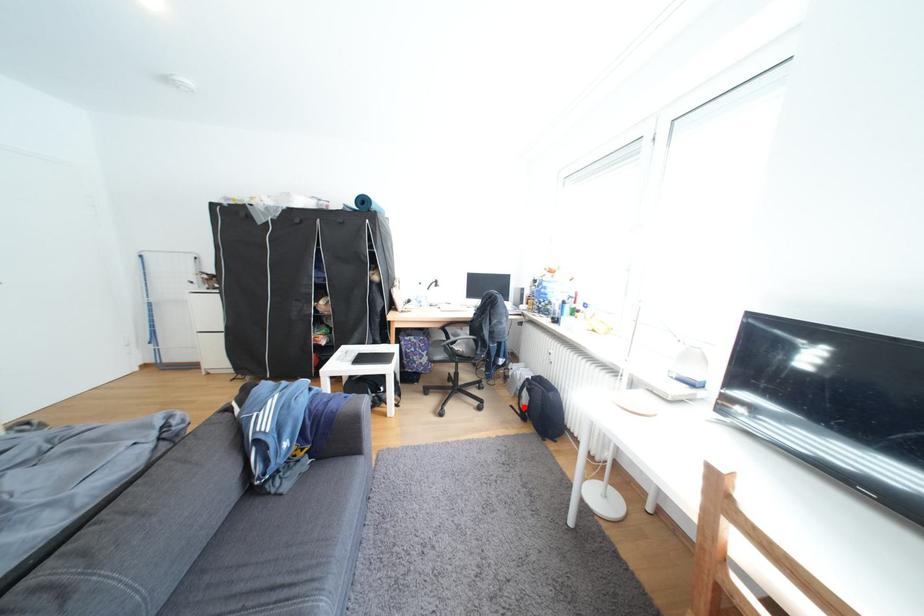
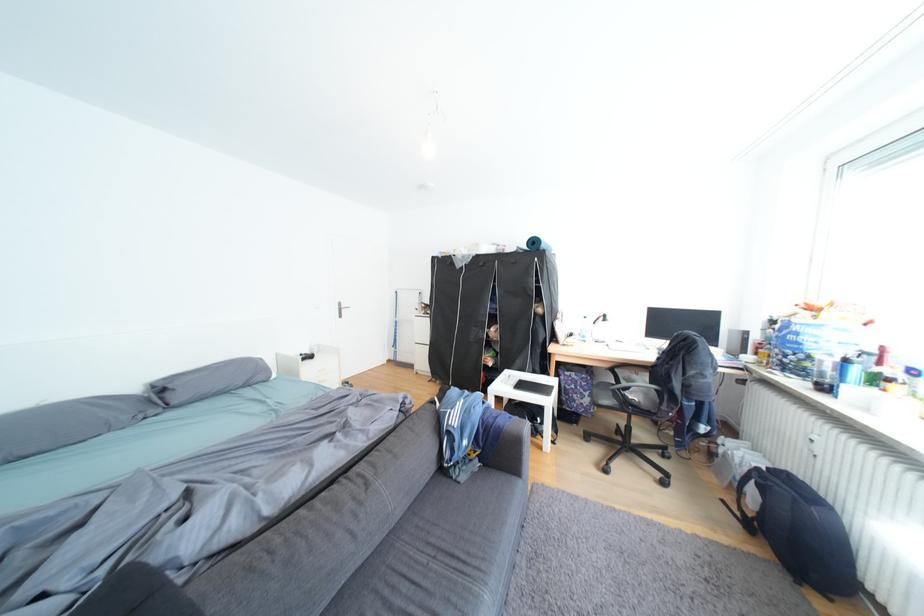
Question: I am providing you with two images of the same scene from different viewpoints. In image1, a red point is highlighted. Considering the same 3D point in image2, which of the following is correct?

Choices:
 (A) It is closer
 (B) It is farther

Answer: (A)